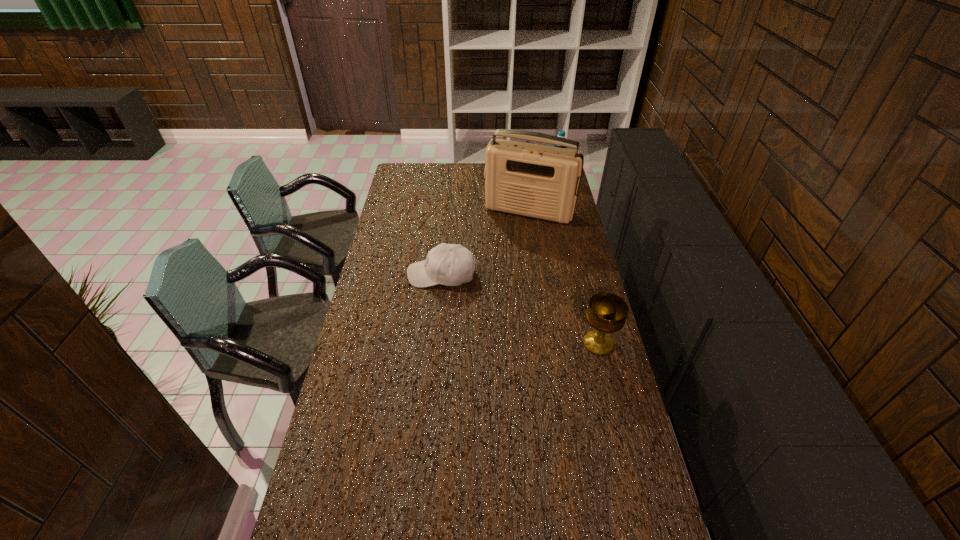
Where is `free space on the desktop that is between the shortest object and the third tallest object and is positioned on the front-facing side of the radio receiver`? The image size is (960, 540). free space on the desktop that is between the shortest object and the third tallest object and is positioned on the front-facing side of the radio receiver is located at coordinates (493, 297).

Where is `free space on the desktop that is between the leftmost object and the chalice and is positioned on the label of the farthest object`? The width and height of the screenshot is (960, 540). free space on the desktop that is between the leftmost object and the chalice and is positioned on the label of the farthest object is located at coordinates (528, 313).